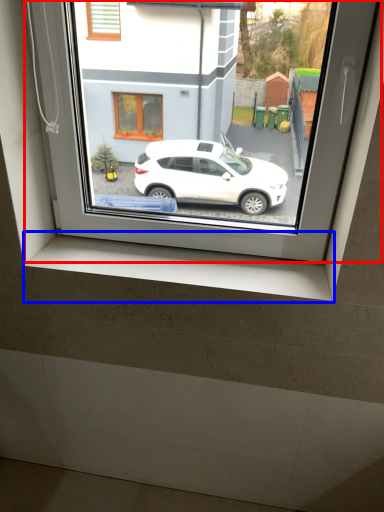
Question: Among these objects, which one is farthest to the camera, window (highlighted by a red box) or window sill (highlighted by a blue box)?

Choices:
 (A) window
 (B) window sill

Answer: (B)